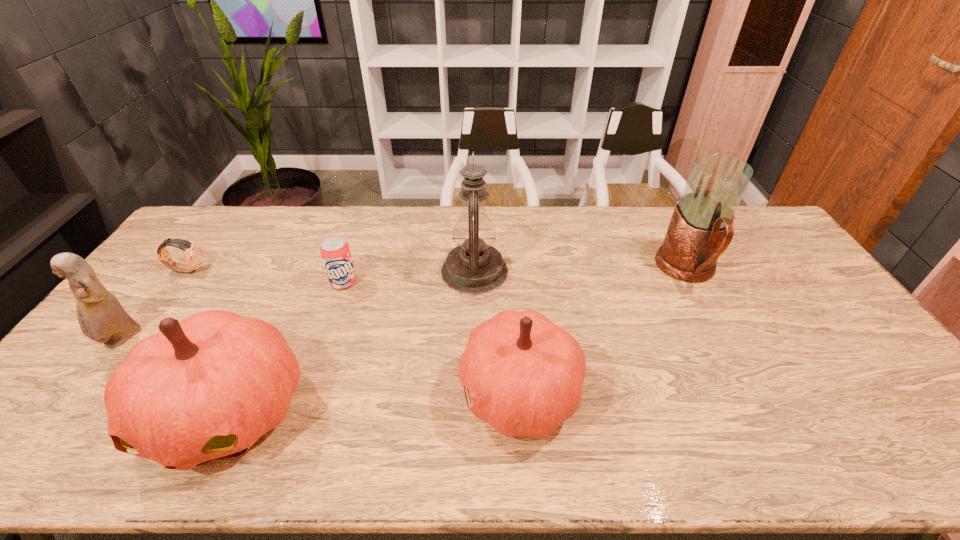
Identify which object is the fourth closest to the left pumpkin. Please provide its 2D coordinates. Your answer should be formatted as a tuple, i.e. [(x, y)], where the tuple contains the x and y coordinates of a point satisfying the conditions above.

[(474, 267)]

This screenshot has height=540, width=960. Find the location of `object that is the fifth closest to the right pumpkin`. object that is the fifth closest to the right pumpkin is located at coordinates (194, 254).

The width and height of the screenshot is (960, 540). What are the coordinates of `vacant space that satisfies the following two spatial constraints: 1. on the front-facing side of the right pumpkin; 2. on the front-facing side of the left pumpkin` in the screenshot? It's located at (520, 411).

Identify the location of vacant space that satisfies the following two spatial constraints: 1. on the face of the watch; 2. on the front-facing side of the figurine. (135, 340).